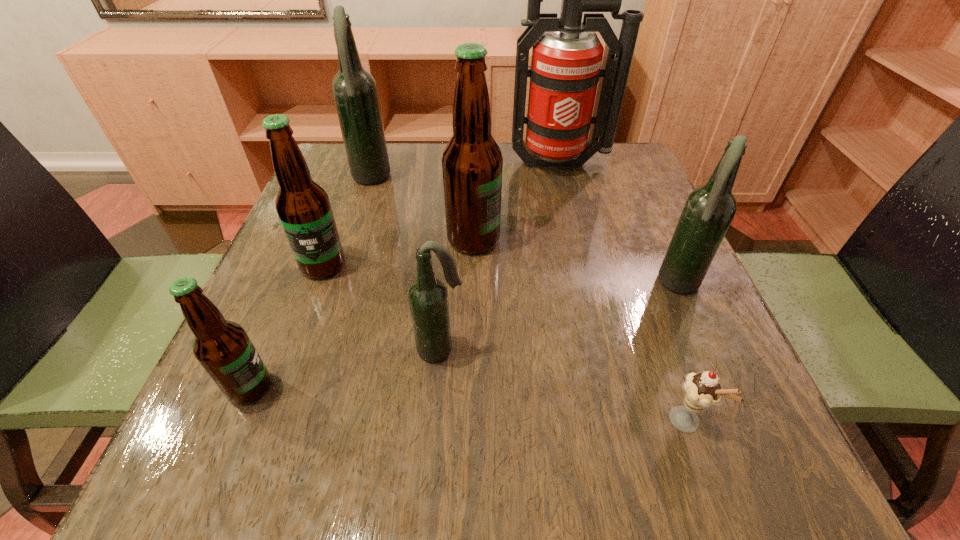
Identify the location of fire extinguisher. (567, 54).

Where is `the farthest beer bottle`? This screenshot has width=960, height=540. the farthest beer bottle is located at coordinates (355, 92).

Where is `the farthest dark beer bottle`? This screenshot has height=540, width=960. the farthest dark beer bottle is located at coordinates (355, 92).

Identify the location of the rightmost brown beer bottle. Image resolution: width=960 pixels, height=540 pixels. (472, 163).

The height and width of the screenshot is (540, 960). In order to click on the rightmost dark beer bottle in this screenshot , I will do `click(709, 210)`.

I want to click on the rightmost object, so click(709, 210).

At what (x,y) coordinates should I click in order to perform the action: click on the second smallest brown beer bottle. Please return your answer as a coordinate pair (x, y). This screenshot has width=960, height=540. Looking at the image, I should click on (303, 206).

This screenshot has width=960, height=540. In order to click on the fifth farthest beer bottle in this screenshot , I will do `click(428, 298)`.

Find the location of a particular element. the nearest dark beer bottle is located at coordinates (428, 298).

What are the coordinates of `the nearest brown beer bottle` in the screenshot? It's located at (223, 348).